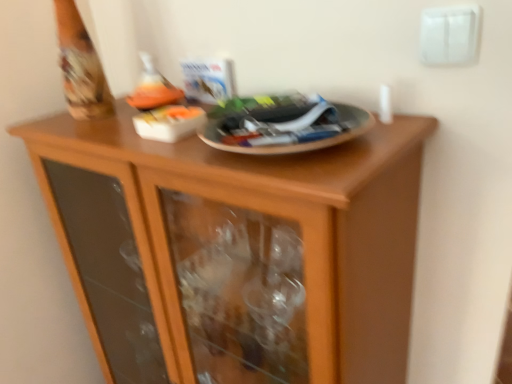
Question: Does white plastic electric outlet at upper right have a greater height compared to wooden cabinet at center?

Choices:
 (A) no
 (B) yes

Answer: (A)

Question: Is white plastic electric outlet at upper right shorter than wooden cabinet at center?

Choices:
 (A) no
 (B) yes

Answer: (B)

Question: From a real-world perspective, does white plastic electric outlet at upper right stand above wooden cabinet at center?

Choices:
 (A) yes
 (B) no

Answer: (A)

Question: Considering the relative sizes of white plastic electric outlet at upper right and wooden cabinet at center in the image provided, is white plastic electric outlet at upper right thinner than wooden cabinet at center?

Choices:
 (A) no
 (B) yes

Answer: (B)

Question: Does white plastic electric outlet at upper right contain wooden cabinet at center?

Choices:
 (A) no
 (B) yes

Answer: (A)

Question: Could you tell me if white plastic electric outlet at upper right is turned towards wooden cabinet at center?

Choices:
 (A) yes
 (B) no

Answer: (B)

Question: Is wooden cabinet at center oriented away from matte orange wine bottle at upper center?

Choices:
 (A) no
 (B) yes

Answer: (A)

Question: Is matte orange wine bottle at upper center a part of wooden cabinet at center?

Choices:
 (A) yes
 (B) no

Answer: (B)

Question: Does wooden cabinet at center have a greater height compared to matte orange wine bottle at upper center?

Choices:
 (A) yes
 (B) no

Answer: (A)

Question: Is wooden cabinet at center further to camera compared to matte orange wine bottle at upper center?

Choices:
 (A) yes
 (B) no

Answer: (B)

Question: Considering the relative positions of wooden cabinet at center and matte orange wine bottle at upper center in the image provided, is wooden cabinet at center to the left of matte orange wine bottle at upper center from the viewer's perspective?

Choices:
 (A) no
 (B) yes

Answer: (A)

Question: From the image's perspective, is wooden cabinet at center over matte orange wine bottle at upper center?

Choices:
 (A) no
 (B) yes

Answer: (A)

Question: Does matte orange wine bottle at upper center lie in front of white plastic electric outlet at upper right?

Choices:
 (A) yes
 (B) no

Answer: (B)